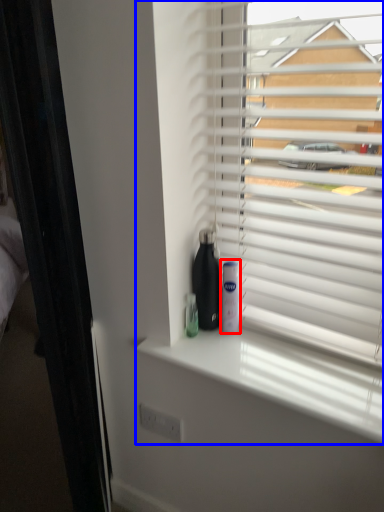
Question: Among these objects, which one is nearest to the camera, mouthwash (highlighted by a red box) or window blind (highlighted by a blue box)?

Choices:
 (A) mouthwash
 (B) window blind

Answer: (B)